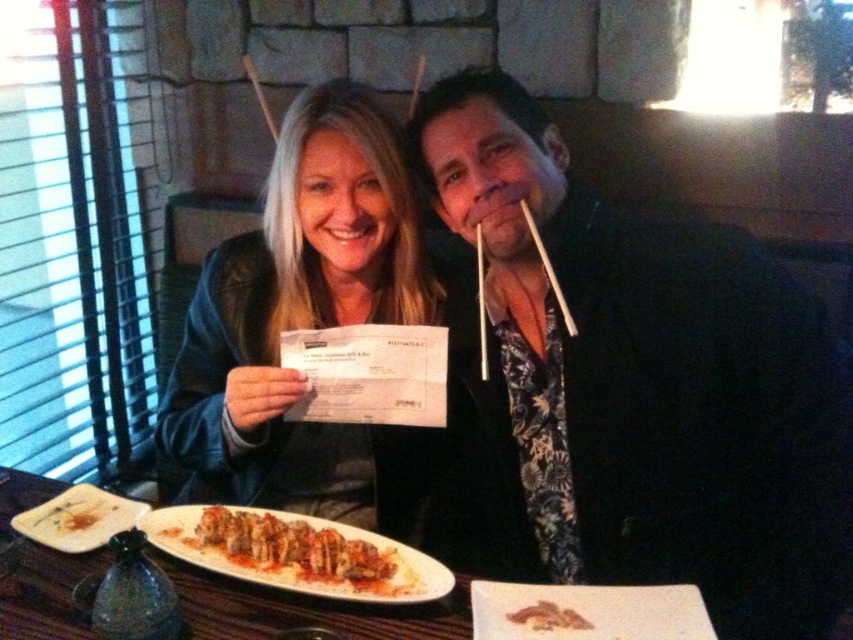
You are a server at the restaurant and need to deliver a drink to the table. The customer wearing the black floral shirt at center has requested it. Where should you place the drink relative to the brown crumbly bread at center?

Place the drink to the right of the brown crumbly bread at center since the black floral shirt at center is located there.

You are a server in a restaurant and need to deliver a dessert menu to the customer wearing the black floral shirt at center and the customer wearing the matte black jacket at center. Which customer should you approach first based on their seating position?

The black floral shirt at center is located above matte black jacket at center, so you should approach the customer wearing the black floral shirt at center first since they are seated closer to the front of the table.

You are a waiter in the restaurant and need to deliver a drink to the table. The drink should be placed on the table near the black floral shirt at center. Based on the coordinates provided in the Objects Description, where exactly should you place the drink?

The black floral shirt at center is located at point (628, 388), so you should place the drink near those coordinates on the table.